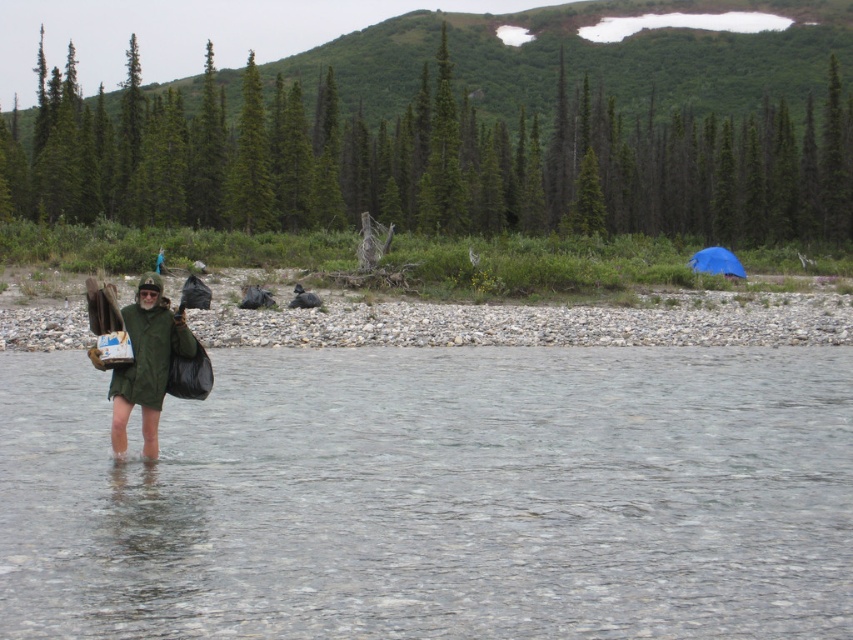
Question: Can you confirm if clear water at center is bigger than blue tarp at right?

Choices:
 (A) no
 (B) yes

Answer: (B)

Question: Among these objects, which one is nearest to the camera?

Choices:
 (A) blue tarp at right
 (B) clear water at center
 (C) green matte jacket at center

Answer: (B)

Question: Considering the relative positions of clear water at center and blue tarp at right in the image provided, where is clear water at center located with respect to blue tarp at right?

Choices:
 (A) left
 (B) right

Answer: (A)

Question: Among these objects, which one is farthest from the camera?

Choices:
 (A) clear water at center
 (B) green matte jacket at center
 (C) blue tarp at right

Answer: (C)

Question: Which point is closer to the camera taking this photo?

Choices:
 (A) (712, 273)
 (B) (537, 381)

Answer: (B)

Question: Can you confirm if clear water at center is bigger than green matte jacket at center?

Choices:
 (A) yes
 (B) no

Answer: (A)